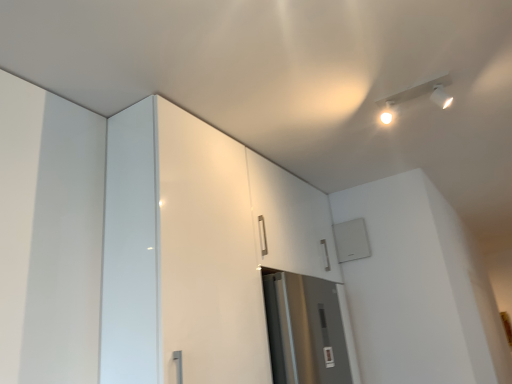
Question: Is white glossy cabinet at upper left facing towards white plastic track lighting at upper right?

Choices:
 (A) no
 (B) yes

Answer: (B)

Question: Is white glossy cabinet at upper left shorter than white plastic track lighting at upper right?

Choices:
 (A) yes
 (B) no

Answer: (B)

Question: Would you say white glossy cabinet at upper left contains white plastic track lighting at upper right?

Choices:
 (A) no
 (B) yes

Answer: (A)

Question: Is white glossy cabinet at upper left not near white plastic track lighting at upper right?

Choices:
 (A) no
 (B) yes

Answer: (A)

Question: Is white glossy cabinet at upper left next to white plastic track lighting at upper right?

Choices:
 (A) yes
 (B) no

Answer: (B)

Question: Is white glossy cabinet at upper left at the right side of white plastic track lighting at upper right?

Choices:
 (A) no
 (B) yes

Answer: (A)

Question: Is white plastic track lighting at upper right smaller than white glossy cabinet at upper left?

Choices:
 (A) yes
 (B) no

Answer: (A)

Question: Is white plastic track lighting at upper right beside white glossy cabinet at upper left?

Choices:
 (A) no
 (B) yes

Answer: (A)

Question: Can you confirm if white plastic track lighting at upper right is positioned to the right of white glossy cabinet at upper left?

Choices:
 (A) yes
 (B) no

Answer: (A)

Question: Considering the relative sizes of white plastic track lighting at upper right and white glossy cabinet at upper left in the image provided, is white plastic track lighting at upper right wider than white glossy cabinet at upper left?

Choices:
 (A) no
 (B) yes

Answer: (A)

Question: Can you confirm if white plastic track lighting at upper right is thinner than white glossy cabinet at upper left?

Choices:
 (A) yes
 (B) no

Answer: (A)

Question: Can you confirm if white plastic track lighting at upper right is bigger than white glossy cabinet at upper left?

Choices:
 (A) yes
 (B) no

Answer: (B)

Question: Is white glossy cabinet at upper left spatially inside white plastic track lighting at upper right, or outside of it?

Choices:
 (A) outside
 (B) inside

Answer: (A)